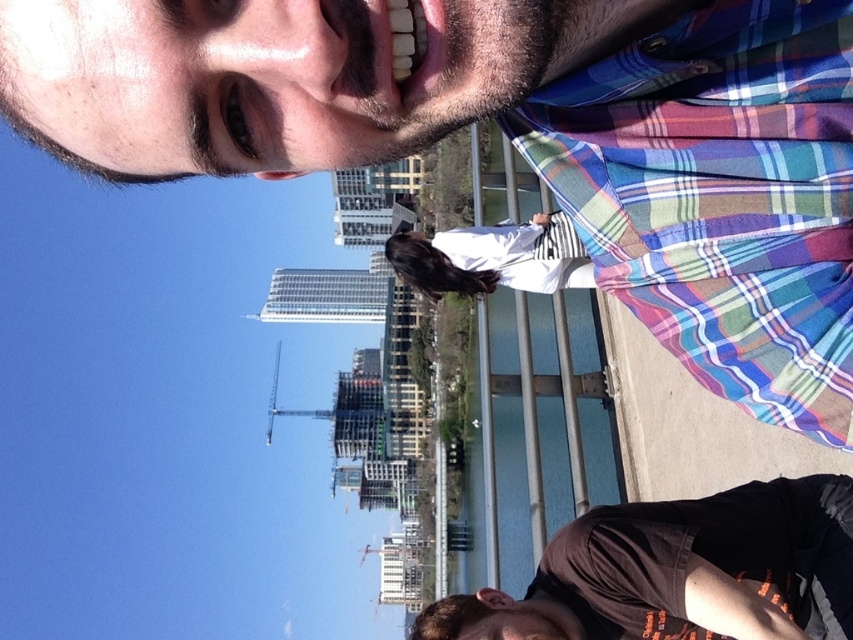
You are a photographer trying to capture a shot of both the brown cotton shirt at lower right and the white cotton shirt at center. Since you want to ensure both shirts are fully visible in the frame, which shirt requires you to adjust your camera angle to accommodate its larger size?

The brown cotton shirt at lower right requires adjusting the camera angle because its width surpasses that of the white cotton shirt at center, meaning it is larger and may need more space in the frame.

You are a photographer trying to capture a photo of the two people in the scene. The multicolored plaid shirt at upper right and the brown cotton shirt at lower right. Since you want to ensure both are fully visible in the frame, which person should you focus on first to avoid them moving out of the frame?

The multicolored plaid shirt at upper right is taller than the brown cotton shirt at lower right, so focusing on the multicolored plaid shirt at upper right first would ensure it remains fully visible before adjusting the frame to include the shorter individual.

You are a photographer trying to capture a photo of the cityscape in the background. You notice the multicolored plaid shirt at upper right and the brown cotton shirt at lower right might block the view. Which of these two shirts is closer to the camera and thus more likely to obstruct the background?

The multicolored plaid shirt at upper right is in front of the brown cotton shirt at lower right, so it is closer to the camera and more likely to obstruct the background.